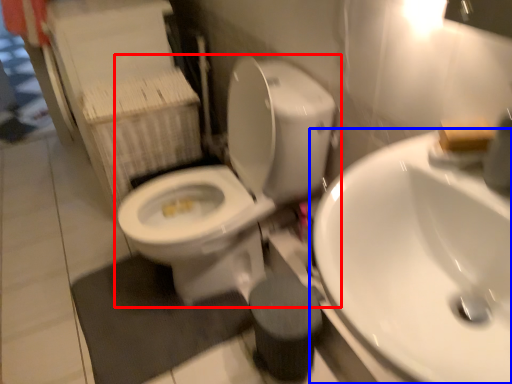
Question: Which object is further to the camera taking this photo, toilet (highlighted by a red box) or sink (highlighted by a blue box)?

Choices:
 (A) toilet
 (B) sink

Answer: (A)